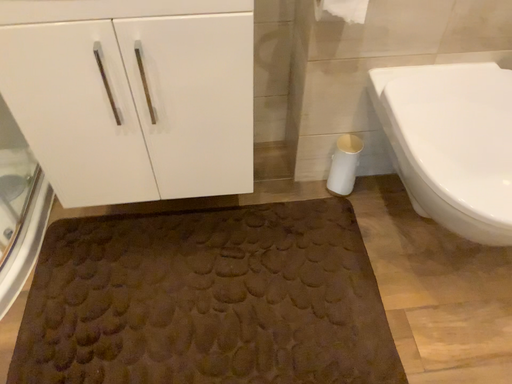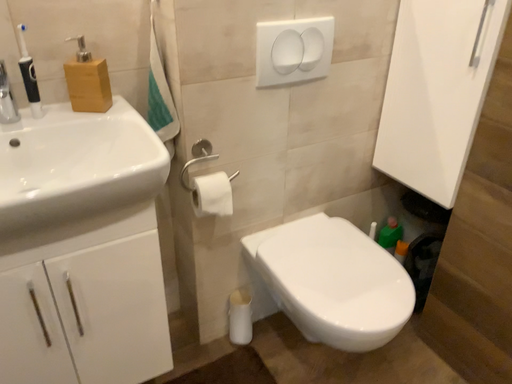
Question: Which way did the camera rotate in the video?

Choices:
 (A) rotated upward
 (B) rotated downward

Answer: (A)